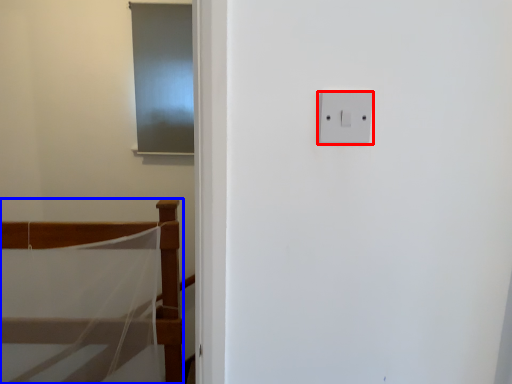
Question: Which object appears closest to the camera in this image, light switch (highlighted by a red box) or furniture (highlighted by a blue box)?

Choices:
 (A) light switch
 (B) furniture

Answer: (A)